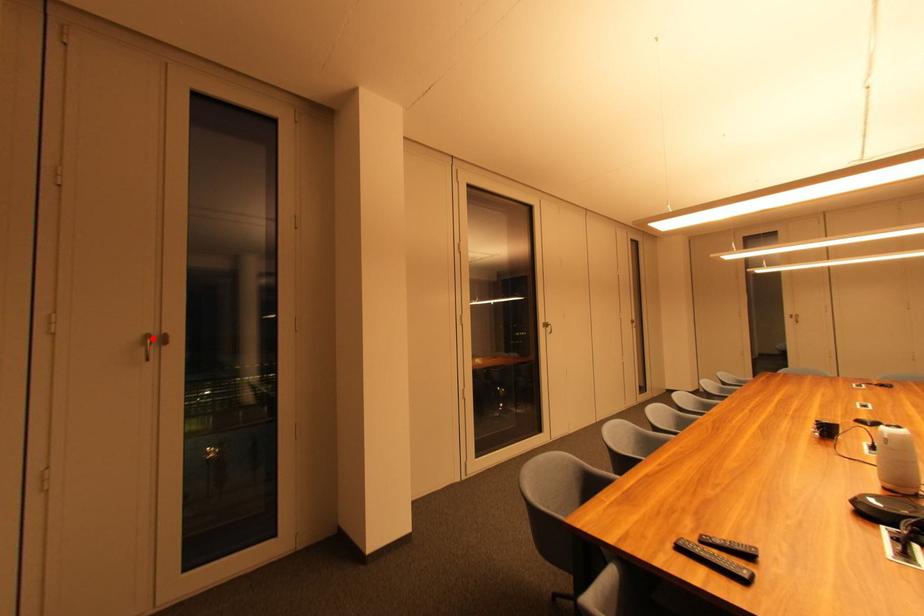
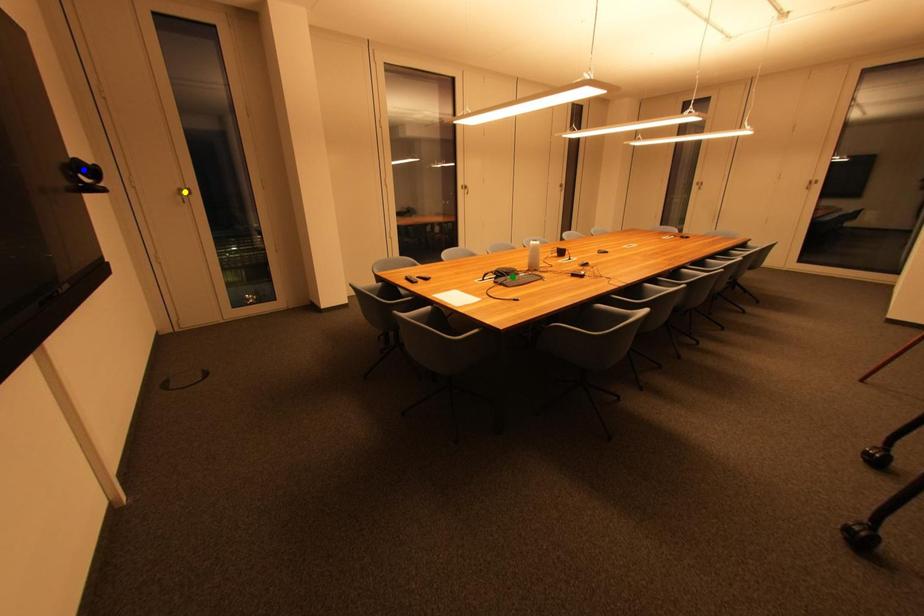
Question: I am providing you with two images of the same scene from different viewpoints. A red point is marked on the first image. You are given multiple points on the second image. In image 2, which mark is for the same physical point as the one in image 1?

Choices:
 (A) green point
 (B) blue point
 (C) yellow point

Answer: (C)